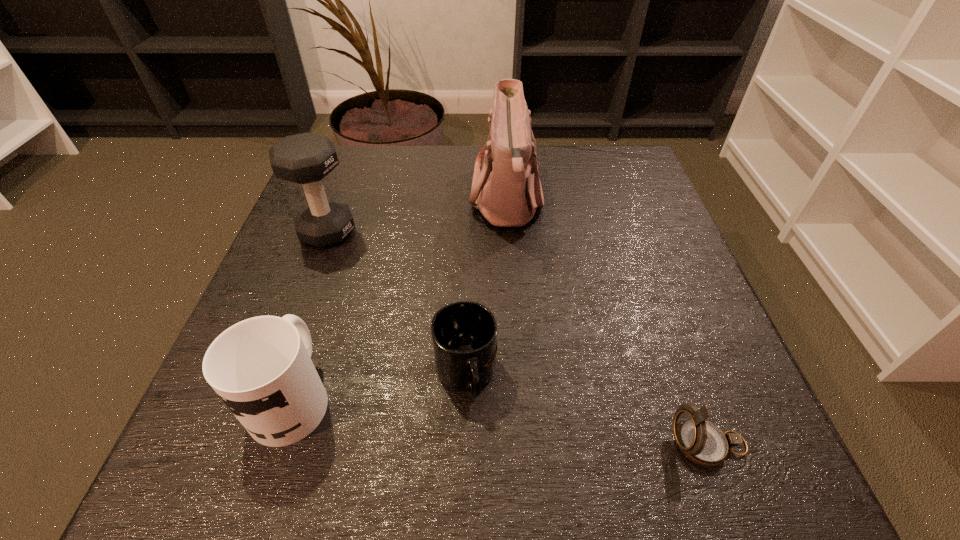
Identify the location of dumbbell present at the left edge. (306, 158).

Locate an element on the screen. mug that is at the left edge is located at coordinates (261, 367).

You are a GUI agent. You are given a task and a screenshot of the screen. Output one action in this format:
    pyautogui.click(x=<x>, y=<y>)
    Task: Click on the object situated at the right edge
    This screenshot has width=960, height=540.
    Given the screenshot: What is the action you would take?
    pyautogui.click(x=702, y=442)

This screenshot has width=960, height=540. I want to click on object located at the near left corner, so click(x=261, y=367).

Locate an element on the screen. The width and height of the screenshot is (960, 540). object at the near right corner is located at coordinates (702, 442).

Where is `vacant space at the far edge`? The width and height of the screenshot is (960, 540). vacant space at the far edge is located at coordinates (405, 167).

The image size is (960, 540). In order to click on vacant space at the left edge in this screenshot , I will do `click(353, 246)`.

Find the location of a particular element. blank area at the right edge is located at coordinates (669, 242).

Where is `free location at the far left corner of the desktop`? The height and width of the screenshot is (540, 960). free location at the far left corner of the desktop is located at coordinates (345, 147).

Image resolution: width=960 pixels, height=540 pixels. I want to click on free space at the far right corner of the desktop, so [621, 166].